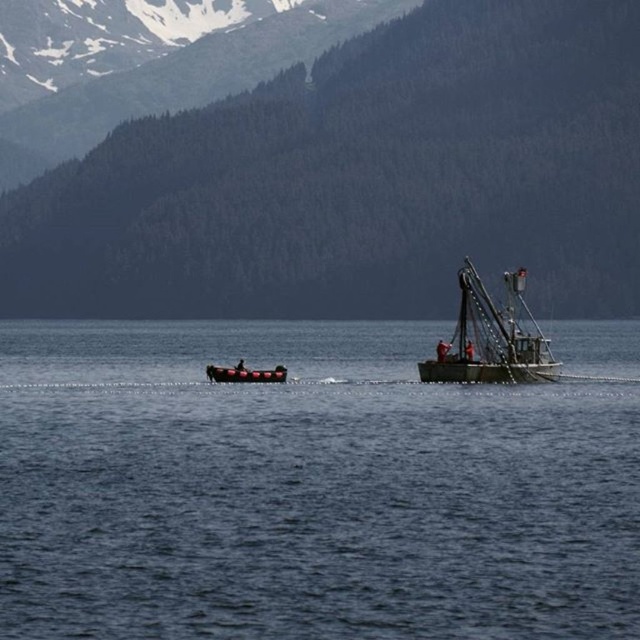
Can you confirm if blue water at center is thinner than greenish metallic fishing boat at center?

Incorrect, blue water at center's width is not less than greenish metallic fishing boat at center's.

Is point (560, 452) less distant than point (499, 336)?

That is True.

You are a GUI agent. You are given a task and a screenshot of the screen. Output one action in this format:
    pyautogui.click(x=<x>, y=<y>)
    Task: Click on the blue water at center
    The height and width of the screenshot is (640, 640).
    Given the screenshot: What is the action you would take?
    pyautogui.click(x=312, y=484)

In the scene shown: Does blue water at center appear on the right side of rubberized red inflatable boat at center?

Correct, you'll find blue water at center to the right of rubberized red inflatable boat at center.

Can you confirm if blue water at center is smaller than rubberized red inflatable boat at center?

Actually, blue water at center might be larger than rubberized red inflatable boat at center.

The height and width of the screenshot is (640, 640). In order to click on blue water at center in this screenshot , I will do pos(312,484).

From the picture: Does blue water at center have a greater height compared to green forested mountain at upper center?

No.

The height and width of the screenshot is (640, 640). Find the location of `blue water at center`. blue water at center is located at coordinates (312, 484).